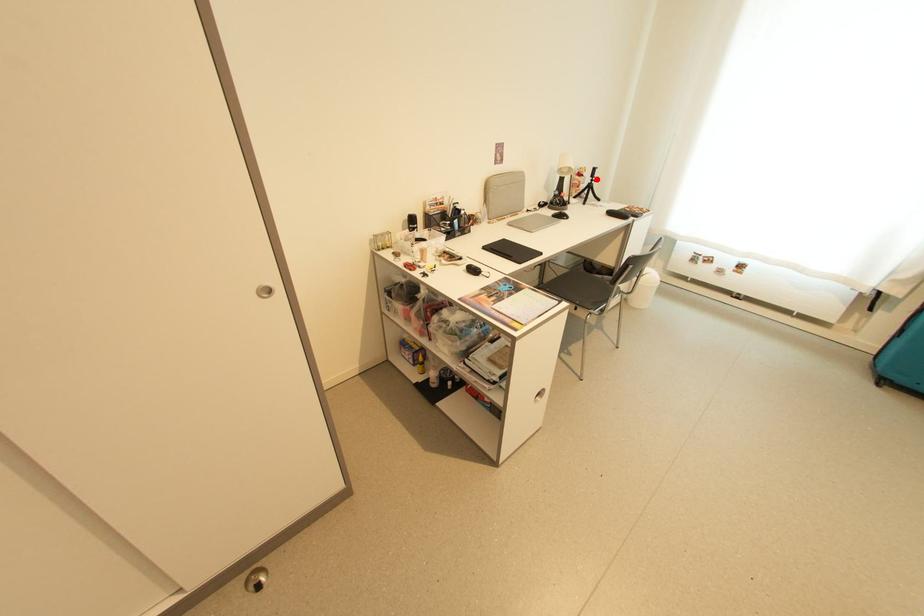
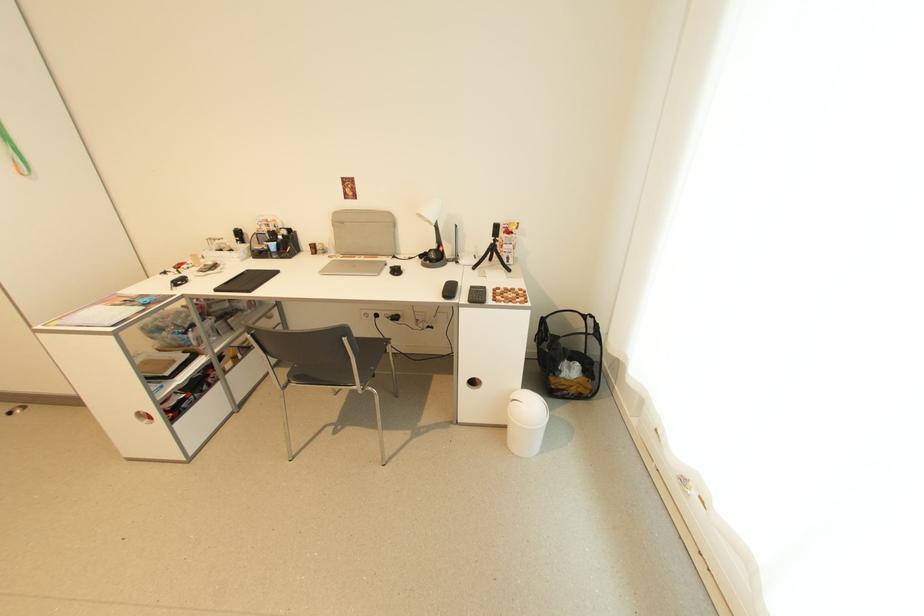
The point at the highlighted location is marked in the first image. Where is the corresponding point in the second image?

(497, 238)